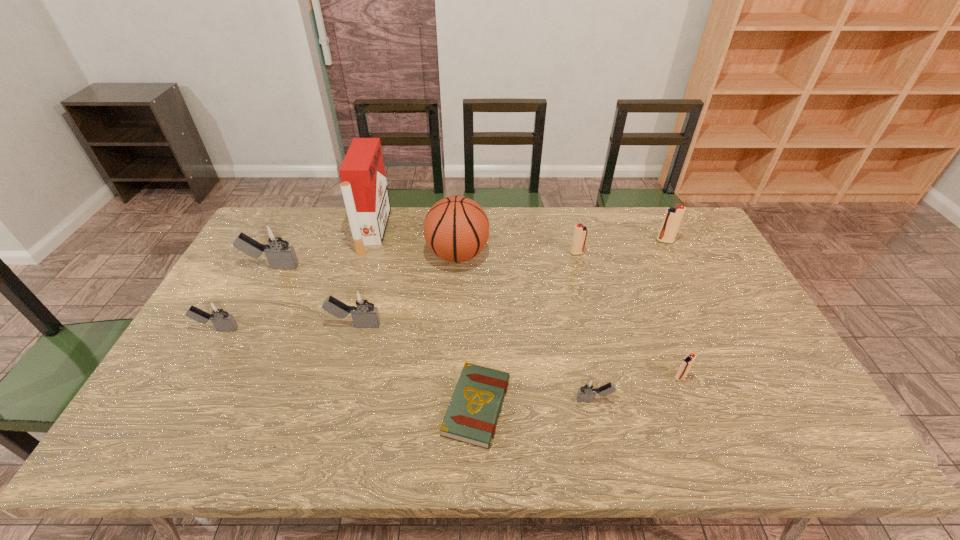
Identify the location of the fifth closest igniter to the tallest object. The image size is (960, 540). (588, 388).

The height and width of the screenshot is (540, 960). Find the location of `gray igniter that is the third closest to the third biggest gray igniter`. gray igniter that is the third closest to the third biggest gray igniter is located at coordinates (588, 388).

Point out which gray igniter is positioned as the third nearest to the second smallest gray igniter. Please provide its 2D coordinates. Your answer should be formatted as a tuple, i.e. [(x, y)], where the tuple contains the x and y coordinates of a point satisfying the conditions above.

[(588, 388)]

Where is `red igniter object that ranks as the third closest to the smallest gray igniter`? The image size is (960, 540). red igniter object that ranks as the third closest to the smallest gray igniter is located at coordinates (673, 216).

The image size is (960, 540). What are the coordinates of `the third closest red igniter to the shortest object` in the screenshot? It's located at (673, 216).

Locate an element on the screen. The width and height of the screenshot is (960, 540). free space that satisfies the following two spatial constraints: 1. on the front-facing side of the cigarette case; 2. on the left side of the second nearest red igniter is located at coordinates (367, 253).

You are a GUI agent. You are given a task and a screenshot of the screen. Output one action in this format:
    pyautogui.click(x=<x>, y=<y>)
    Task: Click on the free space that satisfies the following two spatial constraints: 1. on the front side of the third biggest gray igniter; 2. on the left side of the smallest gray igniter
    The height and width of the screenshot is (540, 960).
    Given the screenshot: What is the action you would take?
    pyautogui.click(x=178, y=400)

Where is `free space that satisfies the following two spatial constraints: 1. on the front-facing side of the cigarette case; 2. on the left side of the smallest red igniter`? The height and width of the screenshot is (540, 960). free space that satisfies the following two spatial constraints: 1. on the front-facing side of the cigarette case; 2. on the left side of the smallest red igniter is located at coordinates (330, 377).

Locate an element on the screen. free space that satisfies the following two spatial constraints: 1. on the back side of the third gray igniter from left to right; 2. on the right side of the sixth nearest igniter is located at coordinates (374, 253).